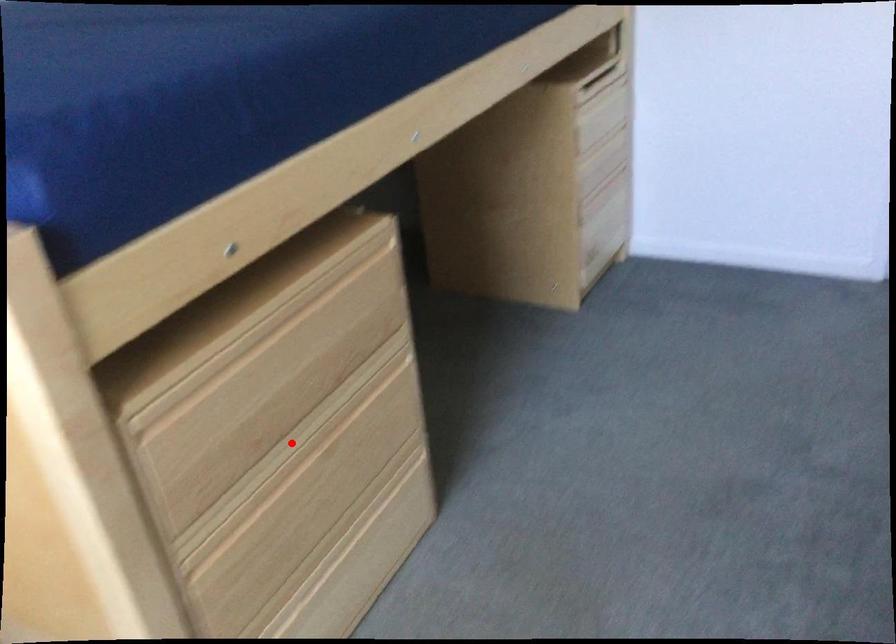
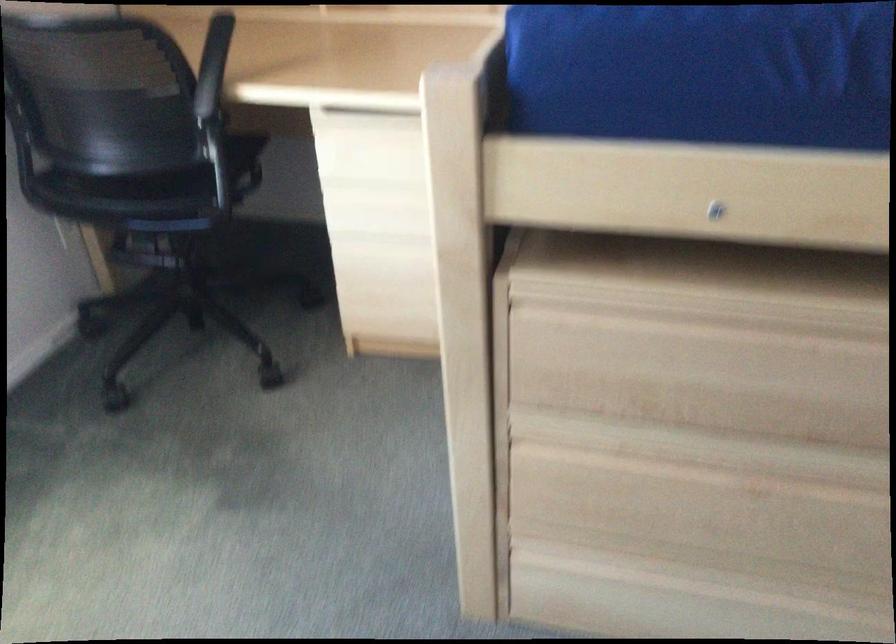
Question: I am providing you with two images of the same scene from different viewpoints. Image1 has a red point marked. In image2, the corresponding 3D location appears at what relative position? Reply with the corresponding letter.

Choices:
 (A) Closer
 (B) Farther

Answer: (A)